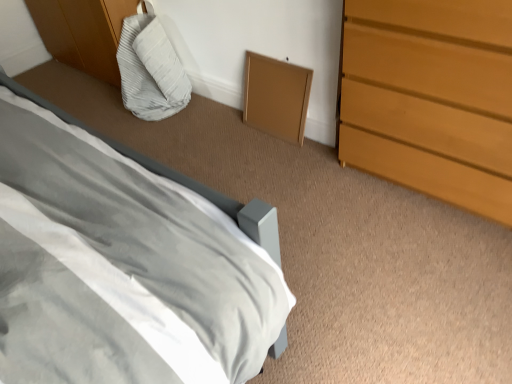
Question: Does light gray fabric bean bag at upper left appear on the right side of matte gray bed at lower left?

Choices:
 (A) yes
 (B) no

Answer: (B)

Question: Is light gray fabric bean bag at upper left looking in the opposite direction of matte gray bed at lower left?

Choices:
 (A) no
 (B) yes

Answer: (A)

Question: Is light gray fabric bean bag at upper left smaller than matte gray bed at lower left?

Choices:
 (A) yes
 (B) no

Answer: (A)

Question: Does light gray fabric bean bag at upper left lie behind matte gray bed at lower left?

Choices:
 (A) no
 (B) yes

Answer: (B)

Question: From a real-world perspective, is light gray fabric bean bag at upper left positioned under matte gray bed at lower left based on gravity?

Choices:
 (A) yes
 (B) no

Answer: (A)

Question: Can you confirm if light gray fabric bean bag at upper left is shorter than matte gray bed at lower left?

Choices:
 (A) no
 (B) yes

Answer: (B)

Question: Considering the relative positions of matte gray bed at lower left and light gray fabric bean bag at upper left in the image provided, is matte gray bed at lower left to the right of light gray fabric bean bag at upper left from the viewer's perspective?

Choices:
 (A) yes
 (B) no

Answer: (A)

Question: From the image's perspective, does matte gray bed at lower left appear lower than light gray fabric bean bag at upper left?

Choices:
 (A) yes
 (B) no

Answer: (A)

Question: From the image's perspective, is matte gray bed at lower left on light gray fabric bean bag at upper left?

Choices:
 (A) yes
 (B) no

Answer: (B)

Question: Is matte gray bed at lower left surrounding light gray fabric bean bag at upper left?

Choices:
 (A) no
 (B) yes

Answer: (A)

Question: Does matte gray bed at lower left have a greater width compared to light gray fabric bean bag at upper left?

Choices:
 (A) yes
 (B) no

Answer: (A)

Question: Considering the relative positions of matte gray bed at lower left and light gray fabric bean bag at upper left in the image provided, is matte gray bed at lower left in front of light gray fabric bean bag at upper left?

Choices:
 (A) no
 (B) yes

Answer: (B)

Question: Is light brown wooden chest of drawers at right wider than matte gray bed at lower left?

Choices:
 (A) yes
 (B) no

Answer: (A)